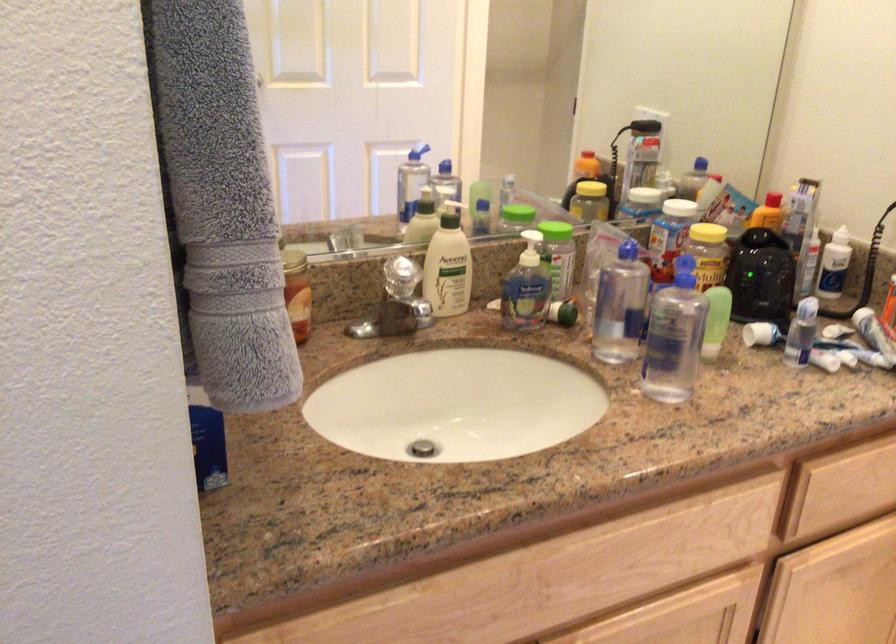
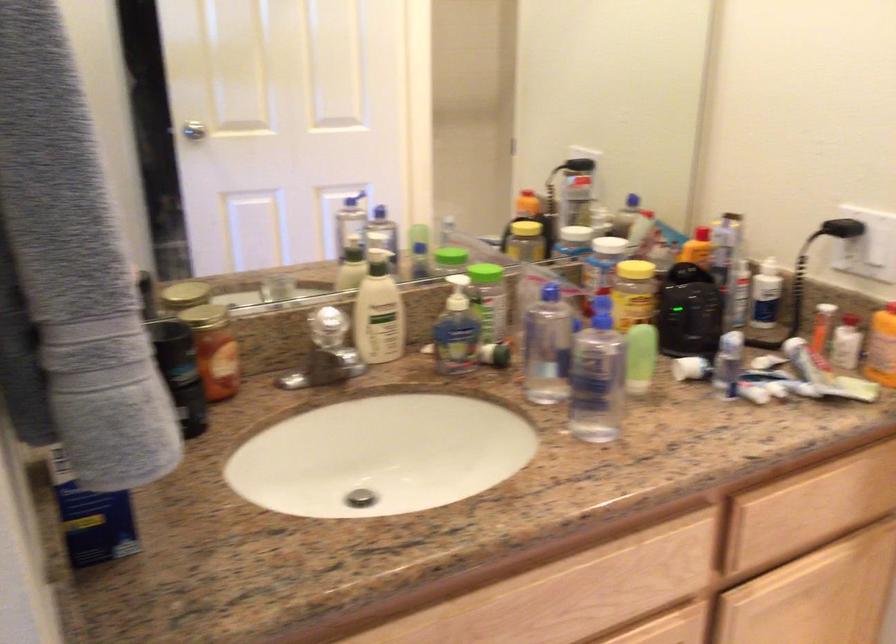
Question: The images are taken continuously from a first-person perspective. In which direction is your viewpoint rotating?

Choices:
 (A) Left
 (B) Right
 (C) Up
 (D) Down

Answer: (C)